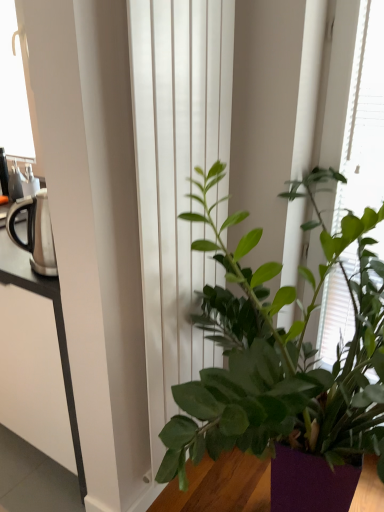
Question: Are white smooth curtain at center and green leafy plant at center far apart?

Choices:
 (A) yes
 (B) no

Answer: (B)

Question: Considering the relative sizes of white smooth curtain at center and green leafy plant at center in the image provided, is white smooth curtain at center wider than green leafy plant at center?

Choices:
 (A) yes
 (B) no

Answer: (B)

Question: From a real-world perspective, does white smooth curtain at center sit lower than green leafy plant at center?

Choices:
 (A) no
 (B) yes

Answer: (A)

Question: Is white smooth curtain at center closer to the viewer compared to green leafy plant at center?

Choices:
 (A) yes
 (B) no

Answer: (A)

Question: From the image's perspective, would you say white smooth curtain at center is shown under green leafy plant at center?

Choices:
 (A) no
 (B) yes

Answer: (B)

Question: From a real-world perspective, is green matte plant at center above or below white smooth curtain at center?

Choices:
 (A) below
 (B) above

Answer: (A)

Question: Is green matte plant at center wider or thinner than white smooth curtain at center?

Choices:
 (A) wide
 (B) thin

Answer: (A)

Question: Is green matte plant at center inside or outside of white smooth curtain at center?

Choices:
 (A) inside
 (B) outside

Answer: (B)

Question: Considering the positions of point (158, 435) and point (147, 333), is point (158, 435) closer or farther from the camera than point (147, 333)?

Choices:
 (A) farther
 (B) closer

Answer: (B)

Question: In terms of size, does green matte plant at center appear bigger or smaller than silver metallic kettle at left?

Choices:
 (A) small
 (B) big

Answer: (B)

Question: In the image, is green matte plant at center on the left side or the right side of silver metallic kettle at left?

Choices:
 (A) left
 (B) right

Answer: (B)

Question: From their relative heights in the image, would you say green matte plant at center is taller or shorter than silver metallic kettle at left?

Choices:
 (A) short
 (B) tall

Answer: (B)

Question: From a real-world perspective, relative to silver metallic kettle at left, is green matte plant at center vertically above or below?

Choices:
 (A) above
 (B) below

Answer: (B)

Question: From a real-world perspective, is green leafy plant at center positioned above or below white smooth curtain at center?

Choices:
 (A) above
 (B) below

Answer: (B)

Question: Is green leafy plant at center in front of or behind white smooth curtain at center in the image?

Choices:
 (A) behind
 (B) front

Answer: (A)